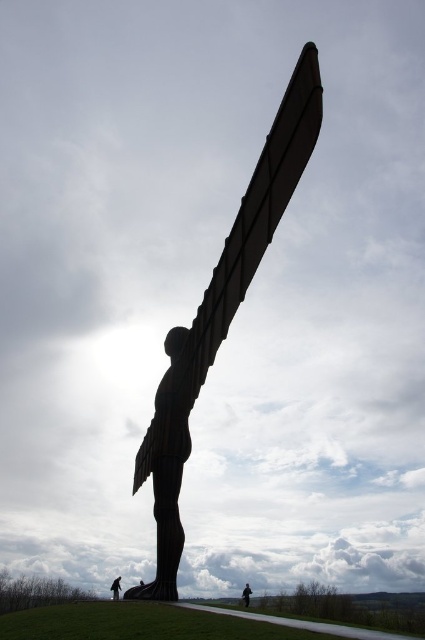
Does black matte figure at lower center come behind dark brown leather jacket at lower center?

No, it is not.

Between black matte figure at lower center and dark brown leather jacket at lower center, which one is positioned lower?

Positioned lower is dark brown leather jacket at lower center.

Does point (115, 588) come behind point (246, 592)?

No.

At what (x,y) coordinates should I click in order to perform the action: click on black matte figure at lower center. Please return your answer as a coordinate pair (x, y). The width and height of the screenshot is (425, 640). Looking at the image, I should click on (116, 588).

Between point (176, 474) and point (249, 596), which one is positioned in front?

Point (176, 474)

Who is more forward, (297,115) or (249,595)?

Point (297,115) is more forward.

This screenshot has width=425, height=640. Identify the location of black polished statue at center. (221, 314).

Is black polished statue at center positioned at the back of black matte figure at lower center?

No, black polished statue at center is closer to the viewer.

Measure the distance between black polished statue at center and camera.

black polished statue at center and camera are 55.38 feet apart from each other.

In order to click on black polished statue at center in this screenshot , I will do `click(221, 314)`.